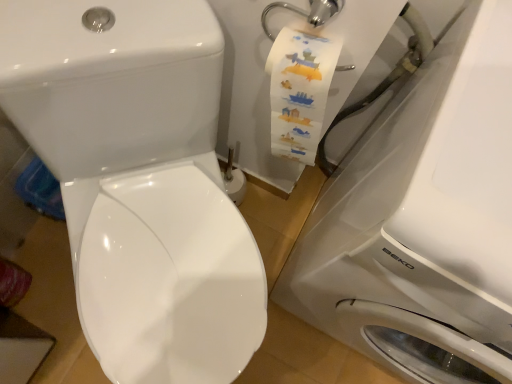
Question: Does white glossy washing machine at right have a greater height compared to white glossy toilet at center?

Choices:
 (A) no
 (B) yes

Answer: (B)

Question: From a real-world perspective, is white glossy washing machine at right on white glossy toilet at center?

Choices:
 (A) no
 (B) yes

Answer: (B)

Question: Considering the relative positions of white glossy washing machine at right and white glossy toilet at center in the image provided, is white glossy washing machine at right in front of white glossy toilet at center?

Choices:
 (A) no
 (B) yes

Answer: (B)

Question: Is white glossy washing machine at right facing towards white glossy toilet at center?

Choices:
 (A) yes
 (B) no

Answer: (B)

Question: Is white glossy washing machine at right far from white glossy toilet at center?

Choices:
 (A) no
 (B) yes

Answer: (A)

Question: Considering the relative sizes of white glossy washing machine at right and white glossy toilet at center in the image provided, is white glossy washing machine at right shorter than white glossy toilet at center?

Choices:
 (A) no
 (B) yes

Answer: (A)

Question: Can you confirm if white glossy toilet at center is taller than white glossy washing machine at right?

Choices:
 (A) no
 (B) yes

Answer: (A)

Question: From the image's perspective, is white glossy toilet at center above white glossy washing machine at right?

Choices:
 (A) no
 (B) yes

Answer: (B)

Question: Is white glossy toilet at center beside white glossy washing machine at right?

Choices:
 (A) no
 (B) yes

Answer: (A)

Question: From the image's perspective, is white glossy toilet at center located beneath white glossy washing machine at right?

Choices:
 (A) yes
 (B) no

Answer: (B)

Question: Is white glossy toilet at center oriented away from white glossy washing machine at right?

Choices:
 (A) yes
 (B) no

Answer: (B)

Question: Does white glossy toilet at center lie behind white glossy washing machine at right?

Choices:
 (A) yes
 (B) no

Answer: (A)

Question: In terms of height, does white glossy washing machine at right look taller or shorter compared to white glossy toilet at center?

Choices:
 (A) short
 (B) tall

Answer: (B)